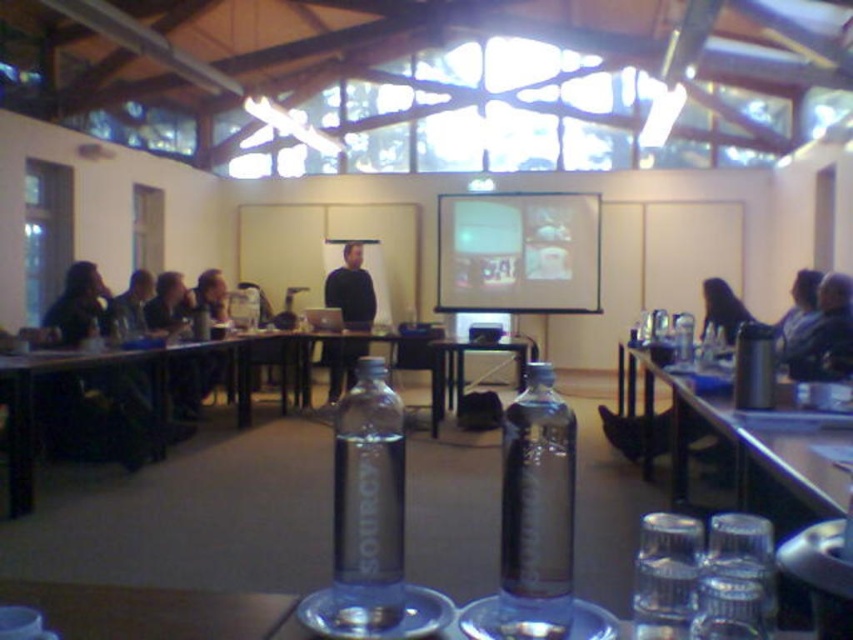
Question: Can you confirm if transparent plastic bottle at lower right is positioned to the left of clear plastic cups at lower right?

Choices:
 (A) no
 (B) yes

Answer: (B)

Question: Where is transparent plastic bottle at lower right located in relation to dark hair at left in the image?

Choices:
 (A) left
 (B) right

Answer: (B)

Question: Is clear plastic cups at right to the left of dark brown leather chair at right from the viewer's perspective?

Choices:
 (A) yes
 (B) no

Answer: (A)

Question: Which object is positioned closest to the blue fabric shirt at upper right?

Choices:
 (A) black matte shirt at center
 (B) transparent plastic projector at center
 (C) transparent plastic bottle at center

Answer: (B)

Question: Which point appears farthest from the camera in this image?

Choices:
 (A) (485, 234)
 (B) (650, 515)

Answer: (A)

Question: Based on their relative distances, which object is nearer to the dark hair at left?

Choices:
 (A) clear plastic water bottle at center
 (B) transparent plastic bottle at center

Answer: (A)